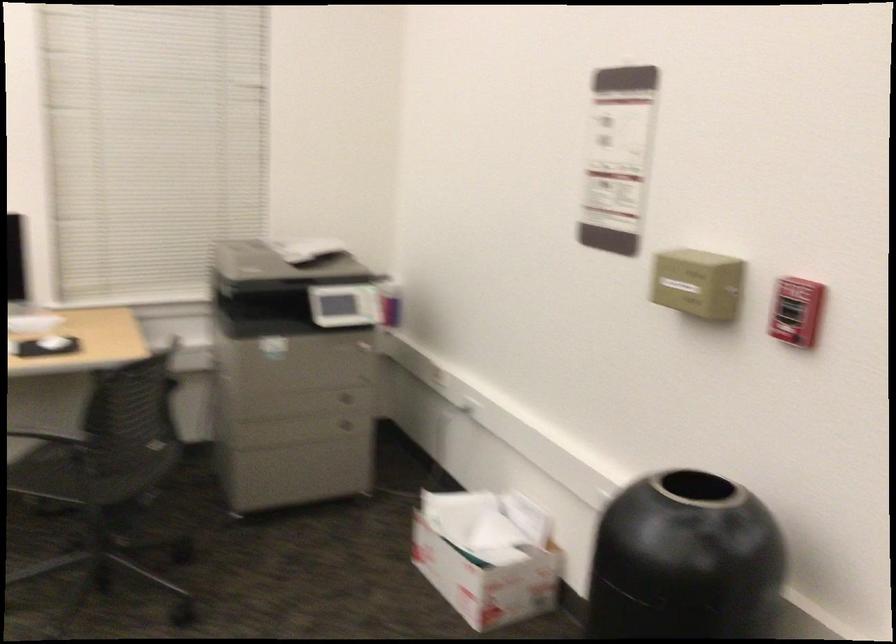
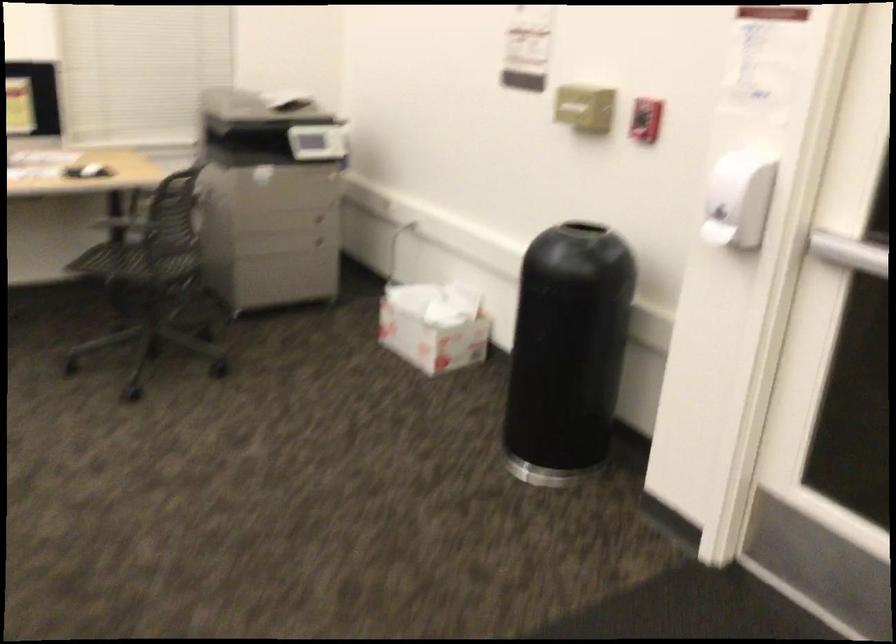
Question: Which direction would the cameraman need to move to produce the second image? Reply with the corresponding letter.

Choices:
 (A) Left
 (B) Right
 (C) Forward
 (D) Backward

Answer: (D)